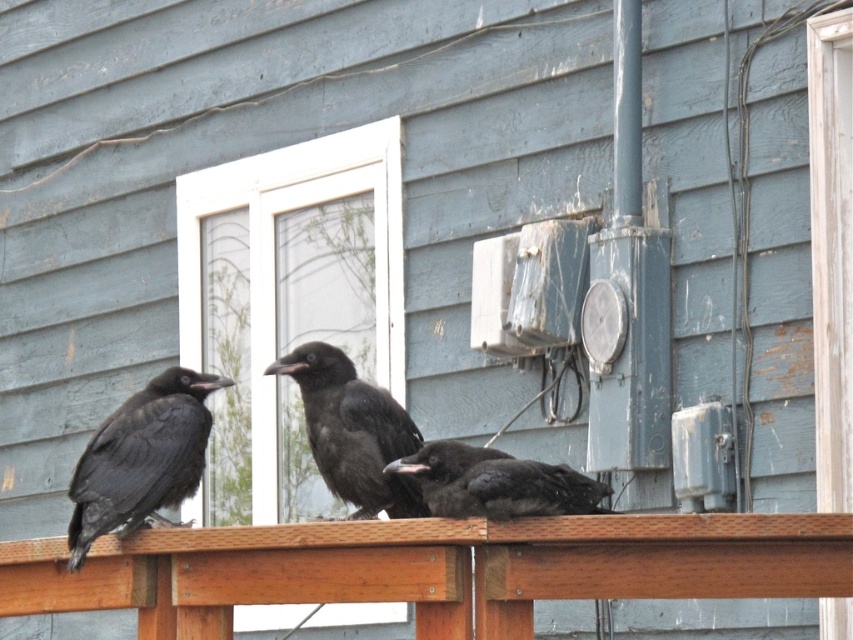
Question: Can you confirm if brown wood rail at center is positioned above shiny black raven at center?

Choices:
 (A) no
 (B) yes

Answer: (A)

Question: Based on their relative distances, which object is farther from the shiny black raven at left?

Choices:
 (A) shiny black raven at center
 (B) brown wood rail at center

Answer: (B)

Question: Which point is farther to the camera?

Choices:
 (A) shiny black raven at center
 (B) brown wood rail at center
 (C) shiny black raven at left

Answer: (A)

Question: Which point is closer to the camera?

Choices:
 (A) (653, 522)
 (B) (184, 410)

Answer: (A)

Question: Does brown wood rail at center have a lesser width compared to shiny black raven at left?

Choices:
 (A) yes
 (B) no

Answer: (B)

Question: Does shiny black raven at left have a smaller size compared to black matte bird at center?

Choices:
 (A) no
 (B) yes

Answer: (A)